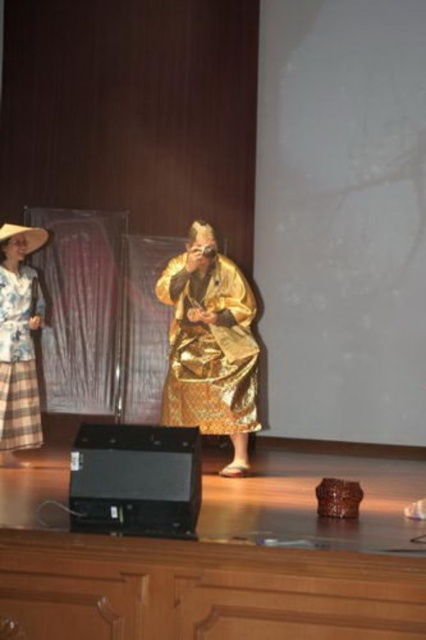
You are an event planner setting up a photo shoot. You need to position a spotlight that will illuminate the gold shiny robe at center and the matte floral dress at left. Since the spotlight can only focus on one object at a time, which object should you illuminate first to ensure the one farther back is still partially visible?

You should illuminate the matte floral dress at left first because the gold shiny robe at center is in front of it. This way, the robe will naturally block some light, but the dress behind will still be partially visible through the spotlight.

You are an event planner arranging a photoshoot. You need to ensure that the gold shiny robe at center and the matte floral dress at left are visible in the frame. Based on their positions, which one is closer to the camera?

The gold shiny robe at center is positioned under the matte floral dress at left, meaning it is closer to the camera since it is placed lower in the frame.